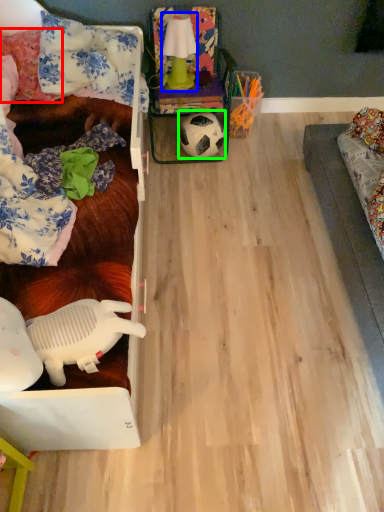
Question: Estimate the real-world distances between objects in this image. Which object is closer to pillow (highlighted by a red box), lamp (highlighted by a blue box) or football (highlighted by a green box)?

Choices:
 (A) lamp
 (B) football

Answer: (A)